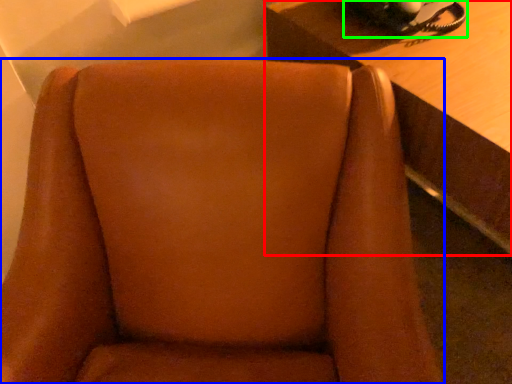
Question: Based on their relative distances, which object is nearer to table (highlighted by a red box)? Choose from chair (highlighted by a blue box) and corded phone (highlighted by a green box).

Choices:
 (A) chair
 (B) corded phone

Answer: (B)